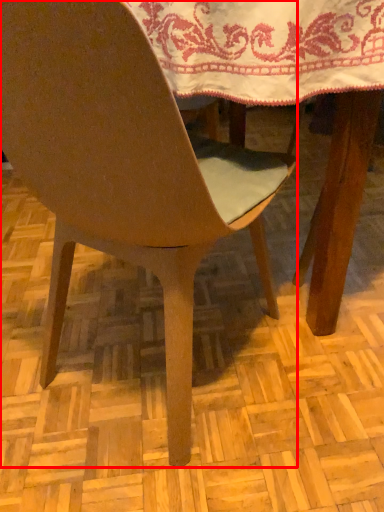
Question: From the image's perspective, considering the relative positions of chair (annotated by the red box) and tablecloth in the image provided, where is chair (annotated by the red box) located with respect to the staircase?

Choices:
 (A) below
 (B) above

Answer: (A)